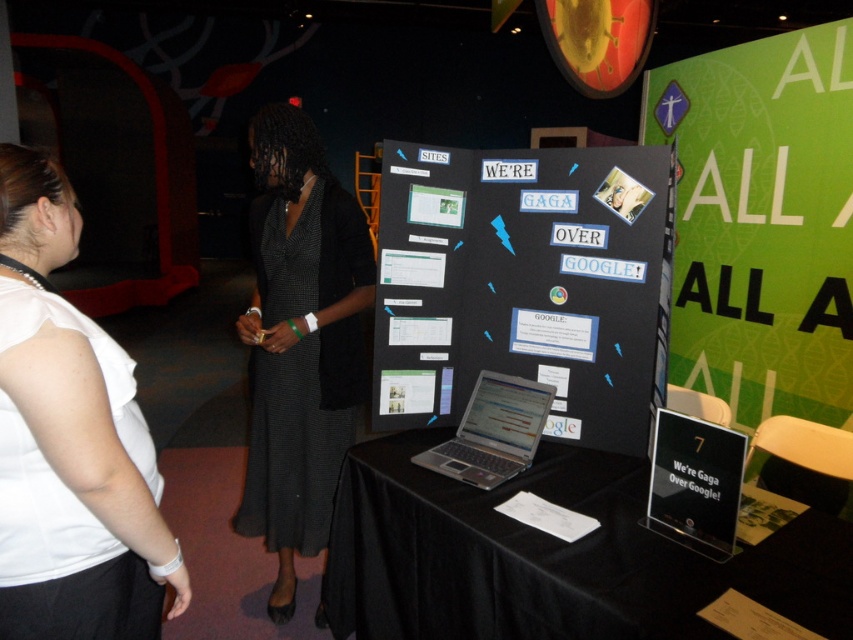
You are a photographer setting up for an event. You need to position a camera on a tripod so that both the black clothed table at center and the black textured dress at center are in frame. Given their distance apart is 26.17 inches, what is the minimum distance you should set the tripod from the two objects to ensure they both fit in the shot?

The black clothed table at center and the black textured dress at center are 26.17 inches apart. To ensure both fit in the camera frame, the tripod should be placed at least 26.17 inches away from the closer object, allowing the entire distance between them to be captured.

You are at a conference and need to locate the table with the signboard that says We are Gaga Over Google! Where should you go relative to the black clothed table at center located at point (549,556)?

The black clothed table at center located at point (549,556) is the table with the signboard that says We are Gaga Over Google! so you should go to the black clothed table at center located at point (549,556).

You are at a conference and need to approach the table. From your current position, which clothing item is higher up between the black textured dress at center and the white fabric shirt at left?

The black textured dress at center is above the white fabric shirt at left, so the black textured dress at center is higher up.